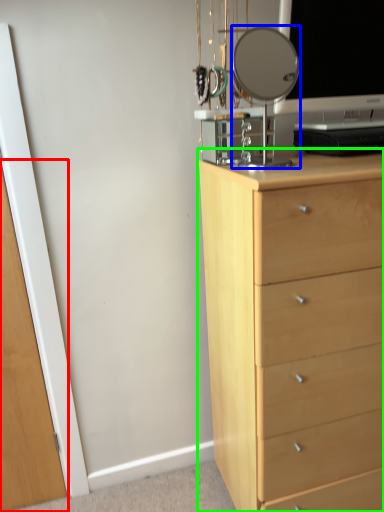
Question: Based on their relative distances, which object is nearer to glass door (highlighted by a red box)? Choose from mirror (highlighted by a blue box) and chest of drawers (highlighted by a green box).

Choices:
 (A) mirror
 (B) chest of drawers

Answer: (B)